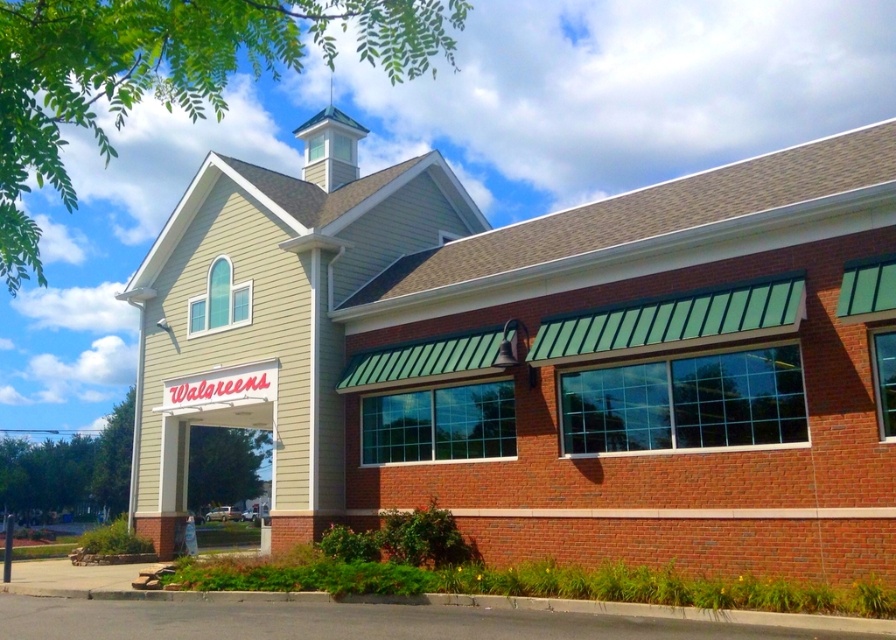
You are standing in front of the Walgreens store and want to take a photo of the beige siding church at center and the white painted wood spire at upper center. Which object should you point your camera towards first to capture both in the frame?

You should point your camera towards the white painted wood spire at upper center first because the beige siding church at center is located below it, ensuring both will be in the frame when centered on the spire.

You are standing in front of the Walgreens store and want to determine the relative positions of two points marked on the facade. Which point, point (192, 374) or point (334, 124), is closer to you?

Point (192, 374) is closer to the viewer than point (334, 124).

You are a delivery person trying to locate the entrance of the Walgreens store. You see the white matte sign at center and the white painted wood spire at upper center. The entrance is directly between them. How far apart are the two landmarks?

The white matte sign at center is 63.02 feet from the white painted wood spire at upper center, so the entrance is located directly between them at a distance of 31.51 feet from each landmark.